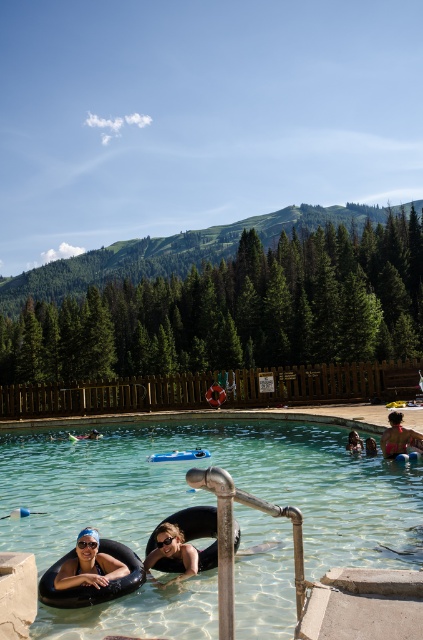
From the picture: You are a lifeguard standing at the edge of the clear plastic pool at center and need to retrieve the matte black swim ring at lower left. Can you reach it without leaving the pool area?

The clear plastic pool at center is taller than the matte black swim ring at lower left, meaning the swim ring is closer to the ground. Since you are at the edge of the pool, you can likely reach the swim ring without leaving the pool area as it is positioned lower and within reach.

You are standing at the edge of the clear plastic pool at center and want to reach the matte black swim ring at lower center. Which direction should you move to get there?

The clear plastic pool at center is positioned on the left side of the matte black swim ring at lower center, so you should move to the right to reach it.